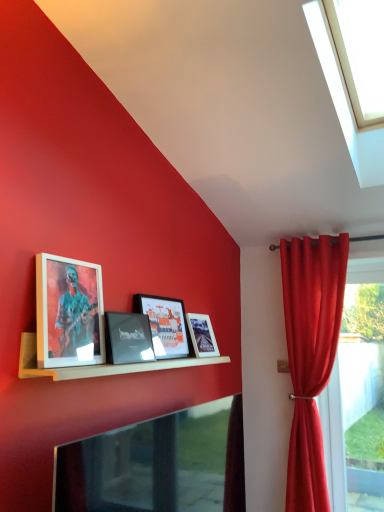
Question: Do you think metallic glossy tv at lower center is within matte white picture frame at center, the first picture frame positioned from the back, or outside of it?

Choices:
 (A) outside
 (B) inside

Answer: (A)

Question: Is metallic glossy tv at lower center wider or thinner than matte white picture frame at center, the first picture frame positioned from the back?

Choices:
 (A) thin
 (B) wide

Answer: (B)

Question: Based on their relative distances, which object is farther from the matte black picture frame at center, which is the 2th picture frame from front to back?

Choices:
 (A) wooden shelf at center
 (B) matte white picture frame at center, which appears as the 4th picture frame when viewed from the front
 (C) transparent glass window at right
 (D) wooden framed picture at upper left, the first picture frame positioned from the front
 (E) velvet red curtain at right

Answer: (C)

Question: Considering the real-world distances, which object is farthest from the metallic glossy tv at lower center?

Choices:
 (A) transparent glass window at right
 (B) matte glass picture frame at center, which is the second picture frame from back to front
 (C) matte white picture frame at center, the first picture frame positioned from the back
 (D) velvet red curtain at right
 (E) wooden shelf at center

Answer: (A)